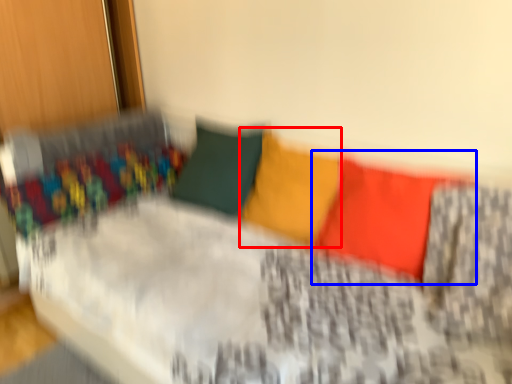
Question: Which point is closer to the camera, pillow (highlighted by a red box) or pillow (highlighted by a blue box)?

Choices:
 (A) pillow
 (B) pillow

Answer: (B)